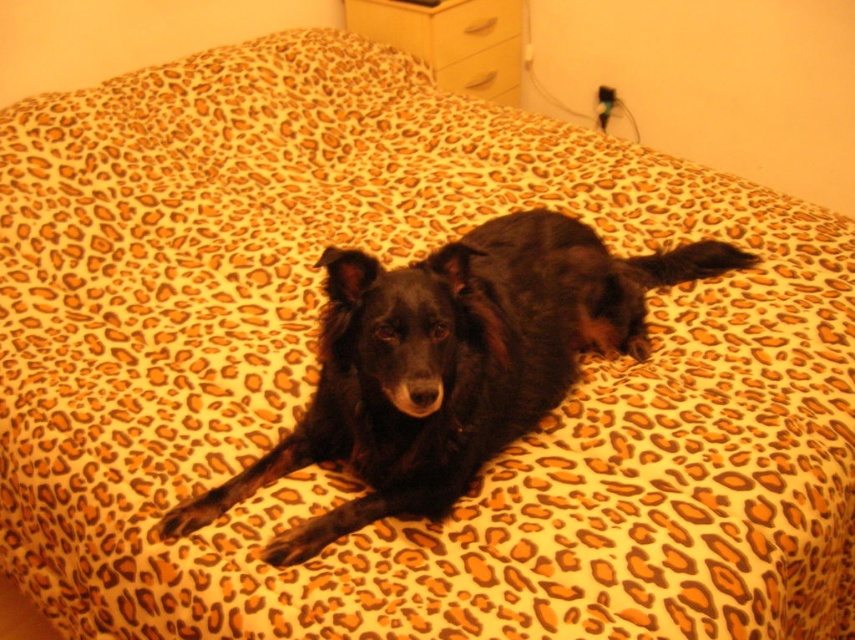
Question: Among these objects, which one is nearest to the camera?

Choices:
 (A) black fur dog at center
 (B) matte yellow drawer at upper center

Answer: (A)

Question: Is black fur dog at center bigger than matte yellow drawer at upper center?

Choices:
 (A) yes
 (B) no

Answer: (A)

Question: Does matte white drawer at upper center have a lesser width compared to matte yellow drawer at upper center?

Choices:
 (A) yes
 (B) no

Answer: (B)

Question: Does black fur dog at center lie in front of matte yellow drawer at upper center?

Choices:
 (A) yes
 (B) no

Answer: (A)

Question: Estimate the real-world distances between objects in this image. Which object is closer to the matte white drawer at upper center?

Choices:
 (A) black fur dog at center
 (B) white glossy dresser at upper center
 (C) matte yellow drawer at upper center

Answer: (B)

Question: Considering the real-world distances, which object is farthest from the black fur dog at center?

Choices:
 (A) matte white drawer at upper center
 (B) white glossy dresser at upper center

Answer: (A)